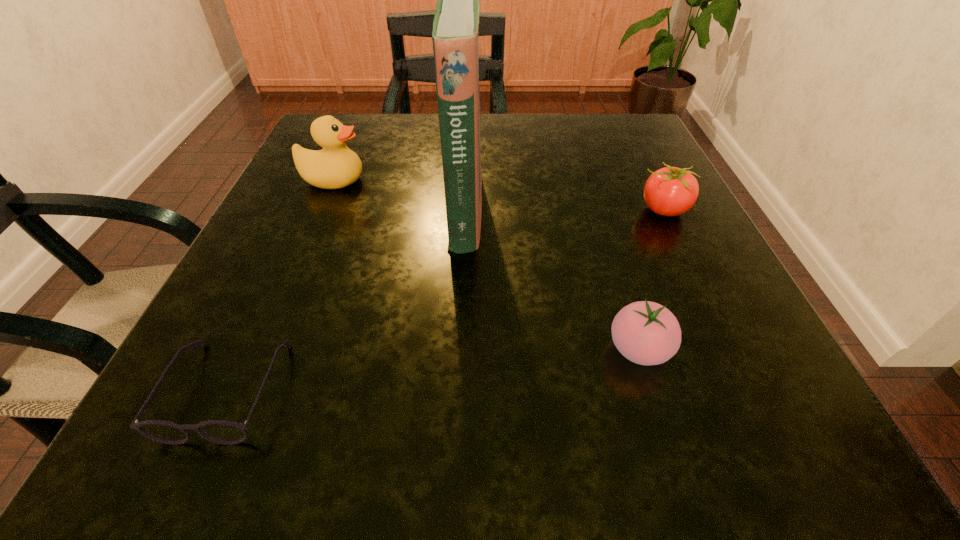
At what (x,y) coordinates should I click in order to perform the action: click on free location located 0.230m on the front of the right tomato. Please return your answer as a coordinate pair (x, y). Image resolution: width=960 pixels, height=540 pixels. Looking at the image, I should click on (723, 332).

You are a GUI agent. You are given a task and a screenshot of the screen. Output one action in this format:
    pyautogui.click(x=<x>, y=<y>)
    Task: Click on the free point located on the back of the left tomato
    The image size is (960, 540).
    Given the screenshot: What is the action you would take?
    pyautogui.click(x=609, y=251)

What are the coordinates of `object situated at the near edge` in the screenshot? It's located at (218, 431).

I want to click on duck present at the left edge, so click(336, 166).

You are a GUI agent. You are given a task and a screenshot of the screen. Output one action in this format:
    pyautogui.click(x=<x>, y=<y>)
    Task: Click on the spectacles at the left edge
    This screenshot has height=540, width=960.
    Given the screenshot: What is the action you would take?
    pyautogui.click(x=218, y=431)

You are a GUI agent. You are given a task and a screenshot of the screen. Output one action in this format:
    pyautogui.click(x=<x>, y=<y>)
    Task: Click on the object situated at the near left corner
    Image resolution: width=960 pixels, height=540 pixels.
    Given the screenshot: What is the action you would take?
    pyautogui.click(x=218, y=431)

Where is `free space at the far edge`? This screenshot has width=960, height=540. free space at the far edge is located at coordinates (494, 161).

The width and height of the screenshot is (960, 540). Identify the location of vacant space at the near edge of the desktop. (597, 407).

Locate an element on the screen. The height and width of the screenshot is (540, 960). blank area at the left edge is located at coordinates (330, 254).

Identify the location of free spot at the right edge of the desktop. The width and height of the screenshot is (960, 540). (643, 171).